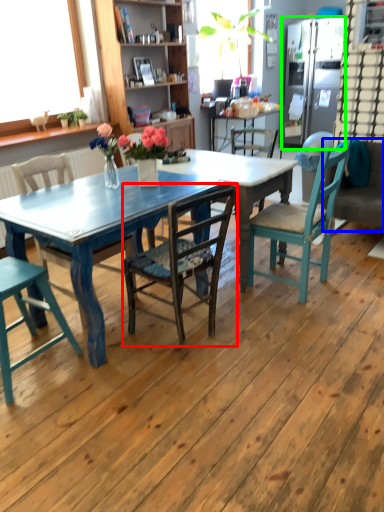
Question: Which object is positioned farthest from chair (highlighted by a red box)? Select from couch (highlighted by a blue box) and refrigerator (highlighted by a green box).

Choices:
 (A) couch
 (B) refrigerator

Answer: (B)